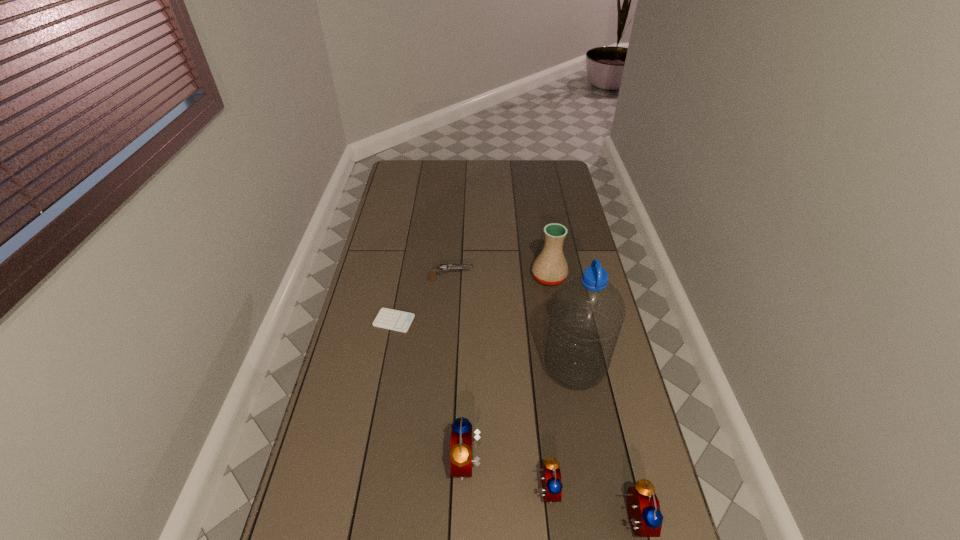
Identify the location of blank space that satisfies the following two spatial constraints: 1. on the back side of the leftmost object; 2. on the left side of the sixth shortest object. Image resolution: width=960 pixels, height=540 pixels. (x=402, y=277).